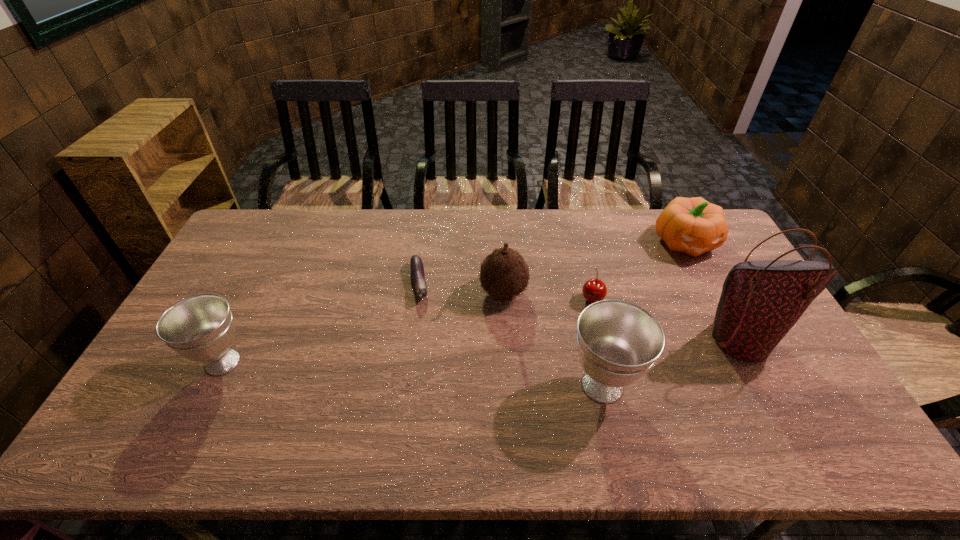
This screenshot has width=960, height=540. In order to click on the left chalice in this screenshot , I will do `click(200, 328)`.

This screenshot has height=540, width=960. Find the location of `the shorter chalice`. the shorter chalice is located at coordinates (200, 328).

Identify the location of the right chalice. (618, 341).

Locate an element on the screen. Image resolution: width=960 pixels, height=540 pixels. pumpkin is located at coordinates (694, 226).

Locate an element on the screen. This screenshot has height=540, width=960. the sixth object from right to left is located at coordinates (416, 265).

Identify the location of the shortest object. Image resolution: width=960 pixels, height=540 pixels. (416, 265).

The height and width of the screenshot is (540, 960). Identify the location of handbag. (761, 301).

Where is `coconut`? This screenshot has height=540, width=960. coconut is located at coordinates (504, 273).

Locate an element on the screen. The image size is (960, 540). the second shortest object is located at coordinates (594, 290).

At what (x,y) coordinates should I click in order to perform the action: click on vacant space located 0.150m on the back of the shorter chalice. Please return your answer as a coordinate pair (x, y). The image size is (960, 540). Looking at the image, I should click on (254, 300).